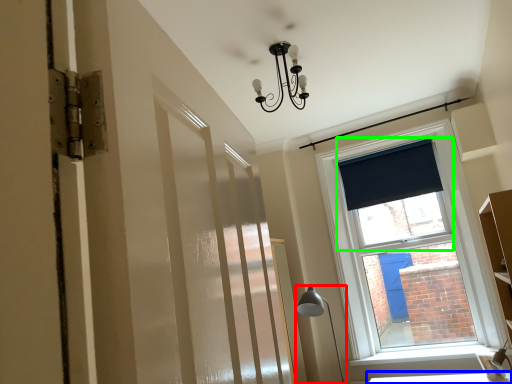
Question: Based on their relative distances, which object is farther from table lamp (highlighted by a red box)? Choose from table (highlighted by a blue box) and window screen (highlighted by a green box).

Choices:
 (A) table
 (B) window screen

Answer: (B)